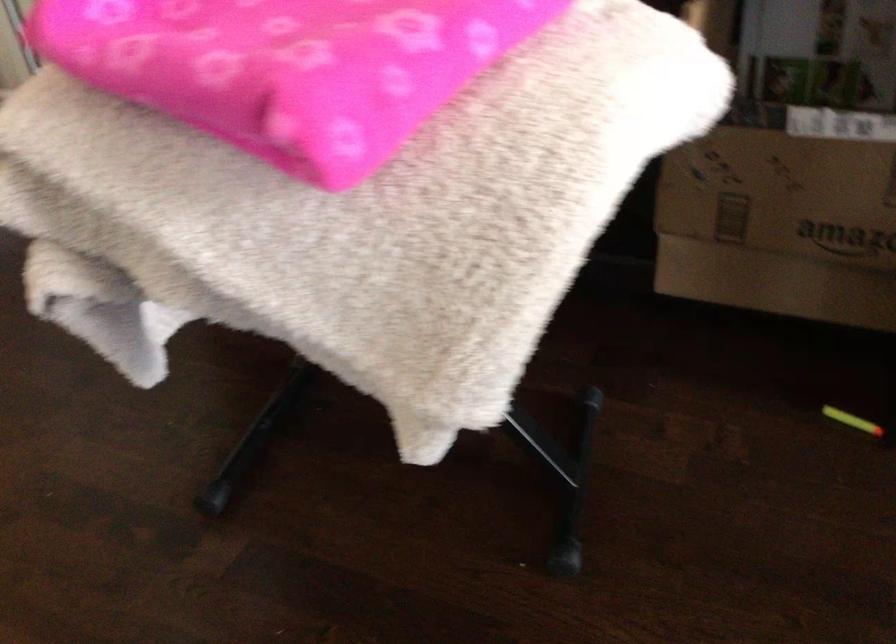
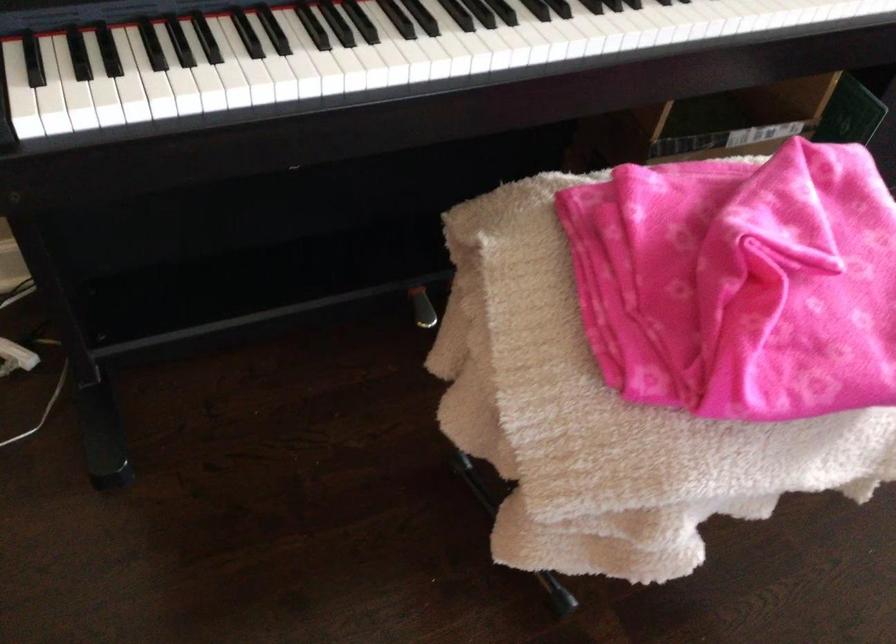
Question: I am providing you with two images of the same scene from different viewpoints. Which of the following objects are not visible in image2?

Choices:
 (A) piano keys
 (B) patterned sofa surface
 (C) piano sustain pedal
 (D) yellow toy dart

Answer: (D)